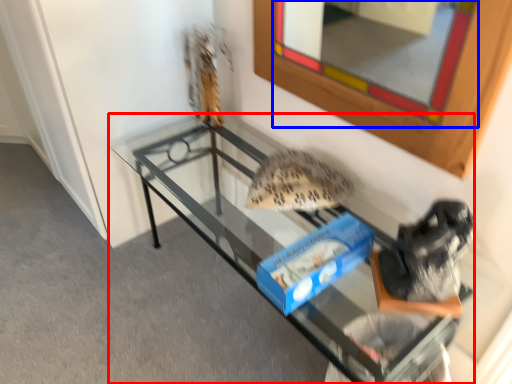
Question: Among these objects, which one is farthest to the camera, furniture (highlighted by a red box) or mirror (highlighted by a blue box)?

Choices:
 (A) furniture
 (B) mirror

Answer: (A)